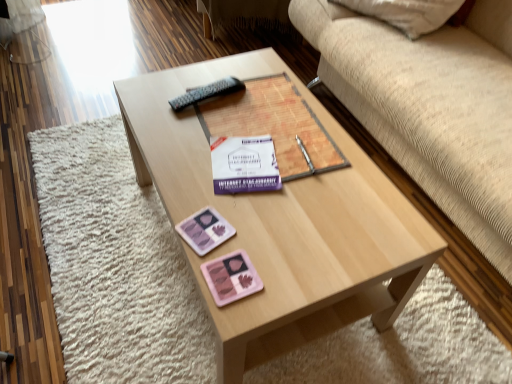
You are a GUI agent. You are given a task and a screenshot of the screen. Output one action in this format:
    pyautogui.click(x=<x>, y=<y>)
    Task: Click on the free space above light wood coffee table at center (from a real-world perspective)
    
    Given the screenshot: What is the action you would take?
    pyautogui.click(x=255, y=153)